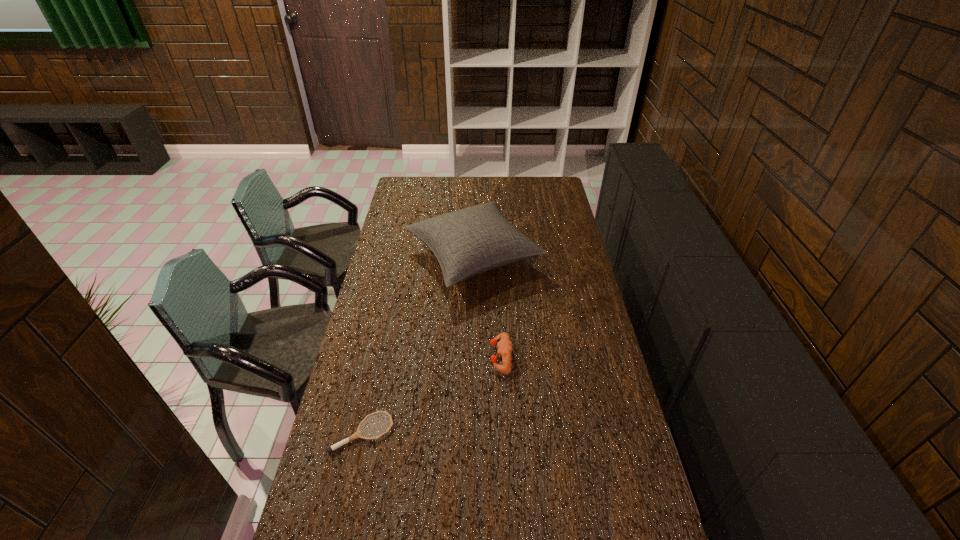
Where is `object that is the second closest to the shortest object`? Image resolution: width=960 pixels, height=540 pixels. object that is the second closest to the shortest object is located at coordinates (467, 242).

Image resolution: width=960 pixels, height=540 pixels. What are the coordinates of `object that is the closest one to the tennis racket` in the screenshot? It's located at (505, 347).

This screenshot has width=960, height=540. I want to click on free space that satisfies the following two spatial constraints: 1. with the gloves of the second nearest object facing forward; 2. on the front side of the shortest object, so click(505, 433).